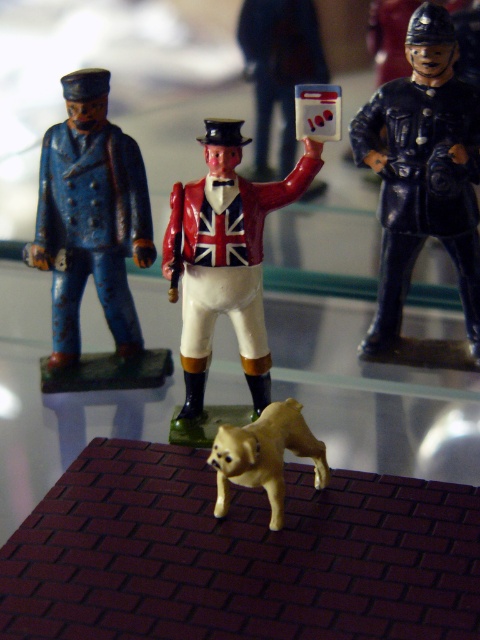
Question: Does glossy dark blue uniform at right appear on the left side of matte blue uniform at left?

Choices:
 (A) no
 (B) yes

Answer: (A)

Question: Does glossy dark blue uniform at right have a greater width compared to matte blue uniform at left?

Choices:
 (A) yes
 (B) no

Answer: (A)

Question: Considering the real-world distances, which object is farthest from the glossy dark blue uniform at right?

Choices:
 (A) matte blue uniform at left
 (B) shiny red plastic figure at center
 (C) shiny gold dog at center

Answer: (C)

Question: Does glossy dark blue uniform at right have a lesser width compared to matte blue uniform at left?

Choices:
 (A) no
 (B) yes

Answer: (A)

Question: Which object is farther from the camera taking this photo?

Choices:
 (A) glossy dark blue uniform at right
 (B) matte blue uniform at left

Answer: (B)

Question: Which of the following is the closest to the observer?

Choices:
 (A) shiny gold dog at center
 (B) glossy dark blue uniform at right

Answer: (A)